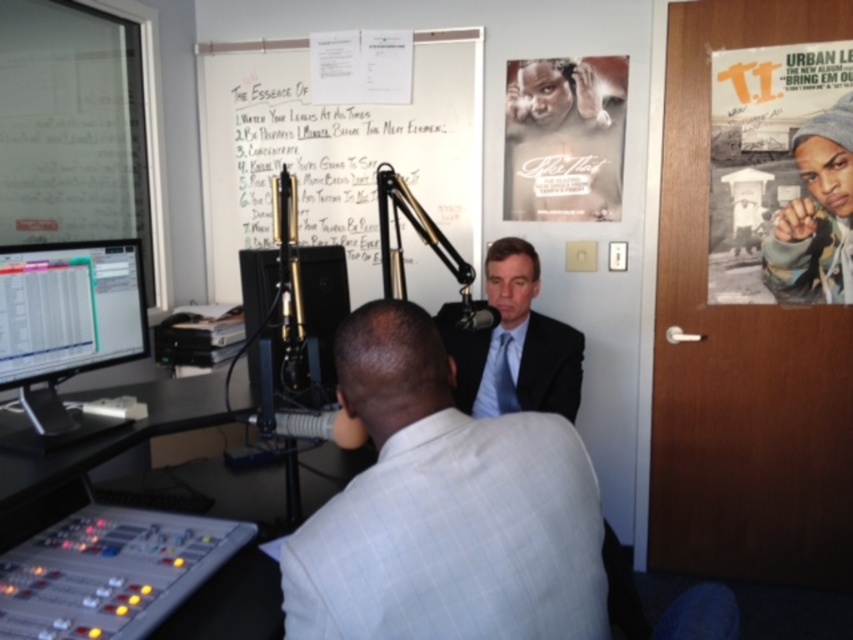
Question: Which point appears closest to the camera in this image?

Choices:
 (A) (791, 99)
 (B) (505, 378)

Answer: (B)

Question: Which object is the closest to the whiteboard at upper center?

Choices:
 (A) black paper poster at door right
 (B) white textured suit at center
 (C) matte black monitor at left

Answer: (A)

Question: Does black paper poster at door right appear on the left side of black matte poster at upper right?

Choices:
 (A) no
 (B) yes

Answer: (A)

Question: Is black paper poster at door right to the left of black matte poster at upper right from the viewer's perspective?

Choices:
 (A) yes
 (B) no

Answer: (B)

Question: Which point is closer to the camera?

Choices:
 (A) white textured suit at center
 (B) black matte poster at upper right
 (C) black paper poster at door right
 (D) whiteboard at upper center

Answer: (A)

Question: Does black matte poster at upper right appear under matte black suit at center?

Choices:
 (A) yes
 (B) no

Answer: (B)